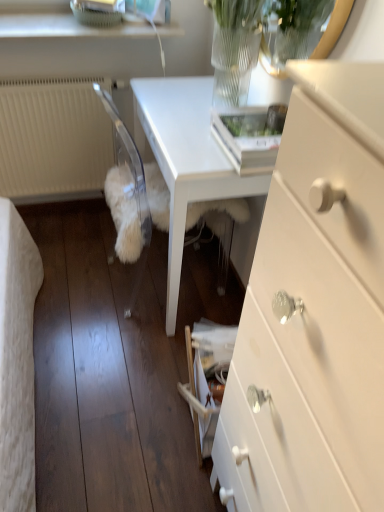
Question: Is white glossy table at center shorter than white glossy chest of drawers at center right?

Choices:
 (A) yes
 (B) no

Answer: (A)

Question: Can you confirm if white glossy table at center is wider than white glossy chest of drawers at center right?

Choices:
 (A) yes
 (B) no

Answer: (A)

Question: Can white glossy chest of drawers at center right be found inside white glossy table at center?

Choices:
 (A) no
 (B) yes

Answer: (A)

Question: Is white glossy table at center not inside white glossy chest of drawers at center right?

Choices:
 (A) no
 (B) yes

Answer: (B)

Question: Considering the relative sizes of white glossy table at center and white glossy chest of drawers at center right in the image provided, is white glossy table at center smaller than white glossy chest of drawers at center right?

Choices:
 (A) no
 (B) yes

Answer: (A)

Question: Visually, is white fluffy dog at lower center positioned to the left or to the right of white textured radiator at left?

Choices:
 (A) left
 (B) right

Answer: (B)

Question: In terms of height, does white fluffy dog at lower center look taller or shorter compared to white textured radiator at left?

Choices:
 (A) tall
 (B) short

Answer: (B)

Question: From the image's perspective, is white fluffy dog at lower center located above or below white textured radiator at left?

Choices:
 (A) above
 (B) below

Answer: (B)

Question: Based on their sizes in the image, would you say white fluffy dog at lower center is bigger or smaller than white textured radiator at left?

Choices:
 (A) small
 (B) big

Answer: (B)

Question: Based on their positions, is white textured radiator at left located to the left or right of white fluffy dog at lower center?

Choices:
 (A) right
 (B) left

Answer: (B)

Question: From their relative heights in the image, would you say white textured radiator at left is taller or shorter than white fluffy dog at lower center?

Choices:
 (A) short
 (B) tall

Answer: (B)

Question: Looking at the image, does white textured radiator at left seem bigger or smaller compared to white fluffy dog at lower center?

Choices:
 (A) small
 (B) big

Answer: (A)

Question: In the image, is white textured radiator at left positioned in front of or behind white fluffy dog at lower center?

Choices:
 (A) front
 (B) behind

Answer: (B)

Question: Considering their positions, is white textured radiator at left located in front of or behind white glossy table at center?

Choices:
 (A) behind
 (B) front

Answer: (A)

Question: From the image's perspective, relative to white glossy table at center, is white textured radiator at left above or below?

Choices:
 (A) below
 (B) above

Answer: (B)